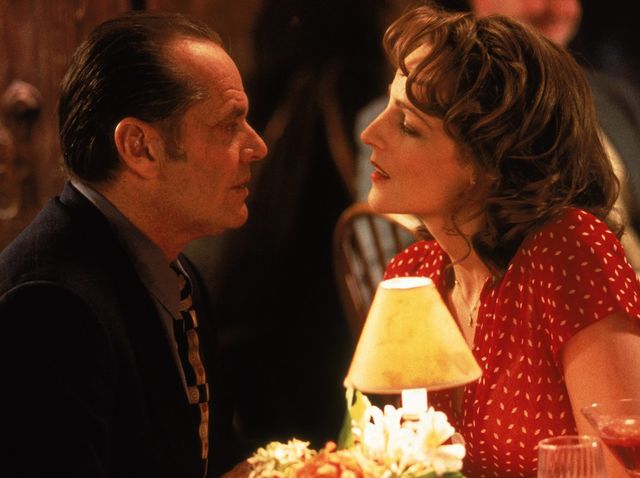
Image resolution: width=640 pixels, height=478 pixels. In order to click on lamp in this screenshot , I will do `click(400, 341)`.